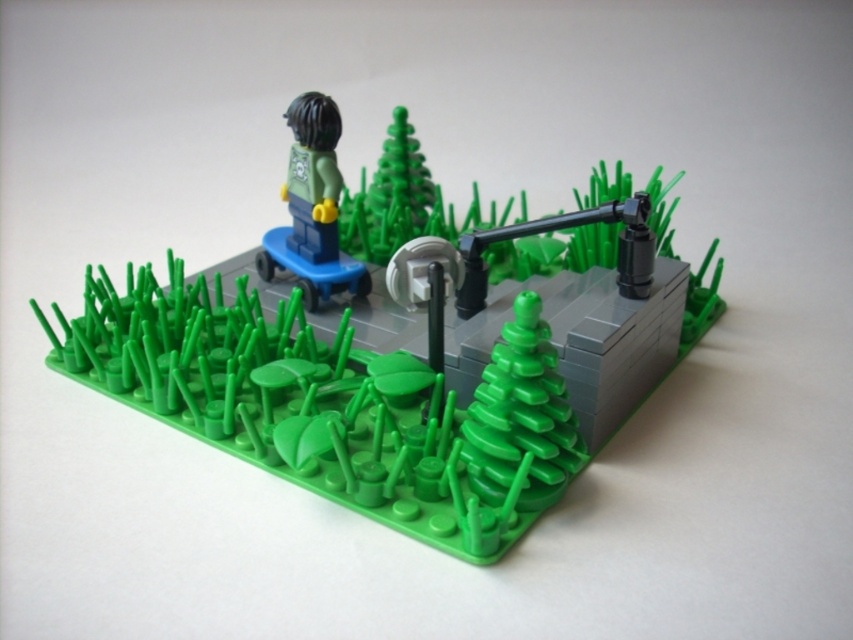
Question: Is matte green tree at center positioned in front of green matte skateboard at upper left?

Choices:
 (A) yes
 (B) no

Answer: (A)

Question: Can you confirm if matte green tree at center is thinner than green matte skateboard at upper left?

Choices:
 (A) no
 (B) yes

Answer: (A)

Question: Considering the relative positions of matte green tree at center and green matte skateboard at upper left in the image provided, where is matte green tree at center located with respect to green matte skateboard at upper left?

Choices:
 (A) left
 (B) right

Answer: (B)